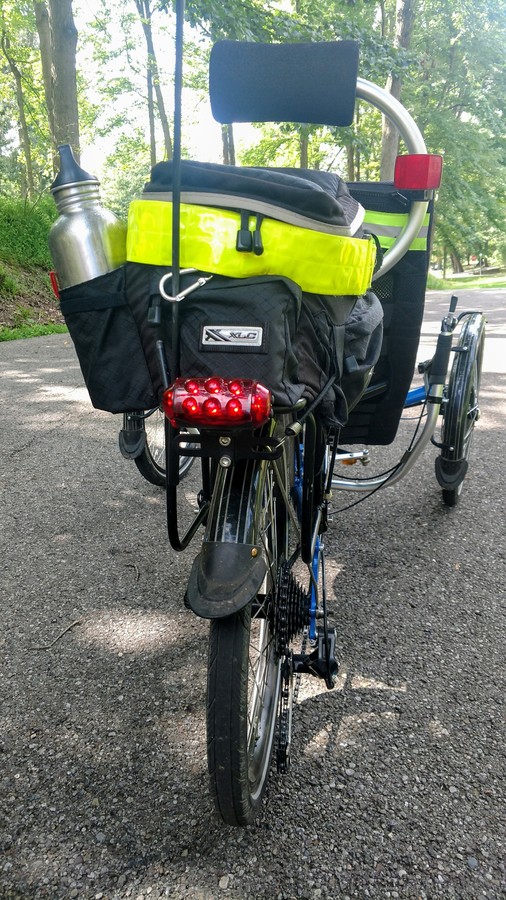
Where is `thermos`? This screenshot has height=900, width=506. thermos is located at coordinates (91, 238).